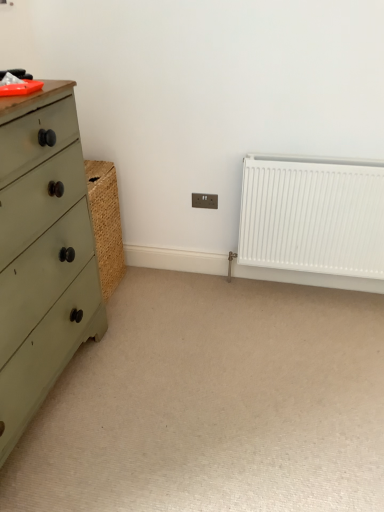
Image resolution: width=384 pixels, height=512 pixels. Find the location of `free spot above beige carpet at center (from a real-world perspective)`. free spot above beige carpet at center (from a real-world perspective) is located at coordinates (235, 382).